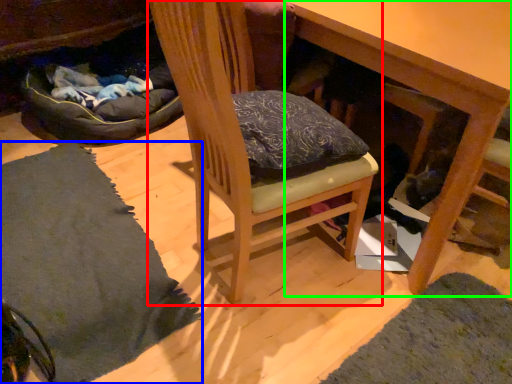
Question: Considering the real-world distances, which object is farthest from chair (highlighted by a red box)? mat (highlighted by a blue box) or table (highlighted by a green box)?

Choices:
 (A) mat
 (B) table

Answer: (A)